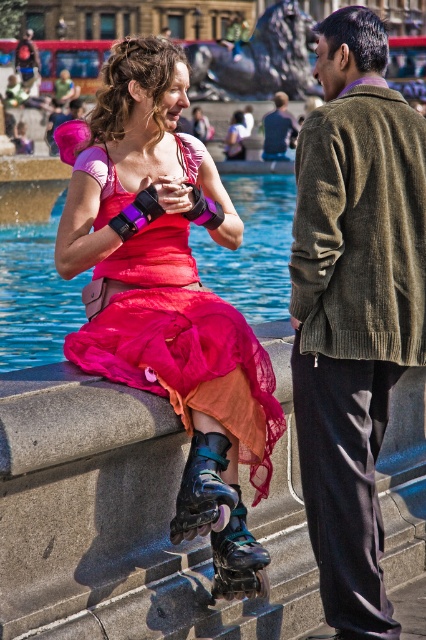
You are a photographer trying to capture the perfect shot of the matte pink dress at center in the urban scene. Based on the coordinates provided, where should you position your camera to ensure the dress is centered in your frame?

The matte pink dress at center is located at coordinates point (166, 282). To center it in your frame, position your camera so that the crosshairs align with these coordinates.

You are a photographer trying to capture a closeup shot of the green corduroy jacket at right and the shiny blue roller skates at lower center. Which object should you zoom in more on to ensure both are in focus?

The green corduroy jacket at right is bigger than the shiny blue roller skates at lower center, so you should zoom in more on the shiny blue roller skates at lower center to ensure both are in focus.